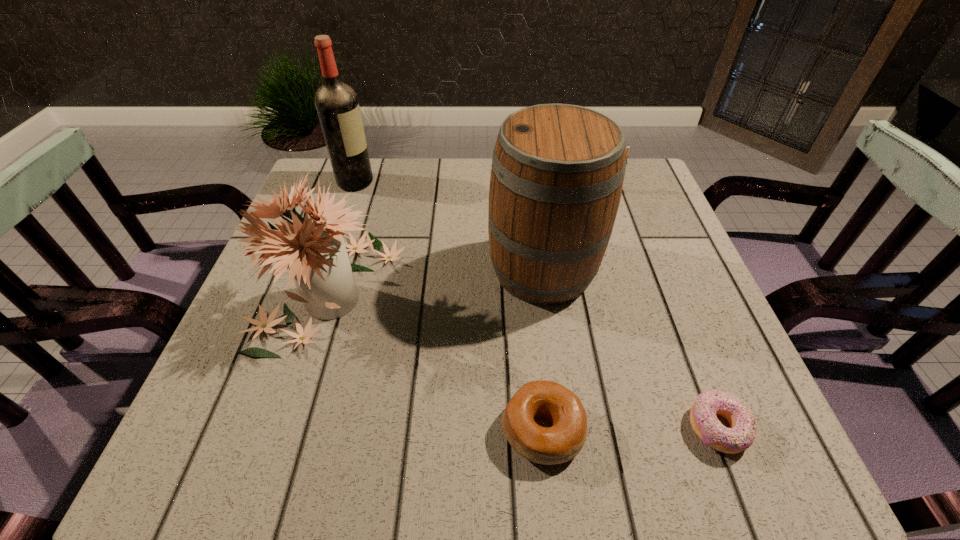
Image resolution: width=960 pixels, height=540 pixels. I want to click on free space in the image that satisfies the following two spatial constraints: 1. on the back side of the bagel; 2. on the left side of the candle, so click(517, 188).

Identify the location of free spot that satisfies the following two spatial constraints: 1. on the front-facing side of the second shortest object; 2. on the right side of the liquor. This screenshot has height=540, width=960. (270, 430).

Find the location of a particular element. Image resolution: width=960 pixels, height=540 pixels. vacant space that satisfies the following two spatial constraints: 1. on the front-facing side of the doughnut; 2. on the left side of the liquor is located at coordinates [x=271, y=428].

At what (x,y) coordinates should I click in order to perform the action: click on free space that satisfies the following two spatial constraints: 1. on the front-facing side of the liquor; 2. on the left side of the doughnut. Please return your answer as a coordinate pair (x, y). The width and height of the screenshot is (960, 540). Looking at the image, I should click on (271, 428).

Locate an element on the screen. The image size is (960, 540). vacant area in the image that satisfies the following two spatial constraints: 1. on the back side of the doughnut; 2. on the front-facing side of the liquor is located at coordinates (621, 182).

You are a GUI agent. You are given a task and a screenshot of the screen. Output one action in this format:
    pyautogui.click(x=<x>, y=<y>)
    Task: Click on the vacant space that satisfies the following two spatial constraints: 1. on the front-facing side of the liquor; 2. on the back side of the shortest object
    This screenshot has height=540, width=960.
    Given the screenshot: What is the action you would take?
    pyautogui.click(x=271, y=428)

In order to click on free space that satisfies the following two spatial constraints: 1. on the front-facing side of the liquor; 2. on the left side of the doughnut in this screenshot , I will do `click(271, 428)`.

Identify the location of vacant space that satisfies the following two spatial constraints: 1. on the front-facing side of the liquor; 2. on the left side of the doughnut. pos(271,428).